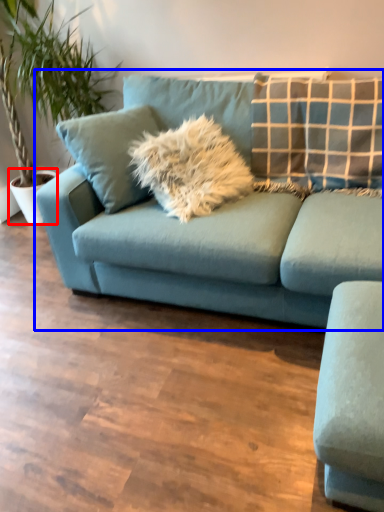
Question: Which object appears farthest to the camera in this image, flowerpot (highlighted by a red box) or studio couch (highlighted by a blue box)?

Choices:
 (A) flowerpot
 (B) studio couch

Answer: (A)